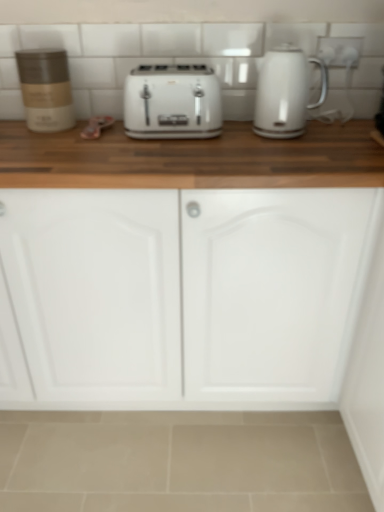
Find the location of a particular element. The width and height of the screenshot is (384, 512). vacant space in front of matte brown container at left is located at coordinates (41, 140).